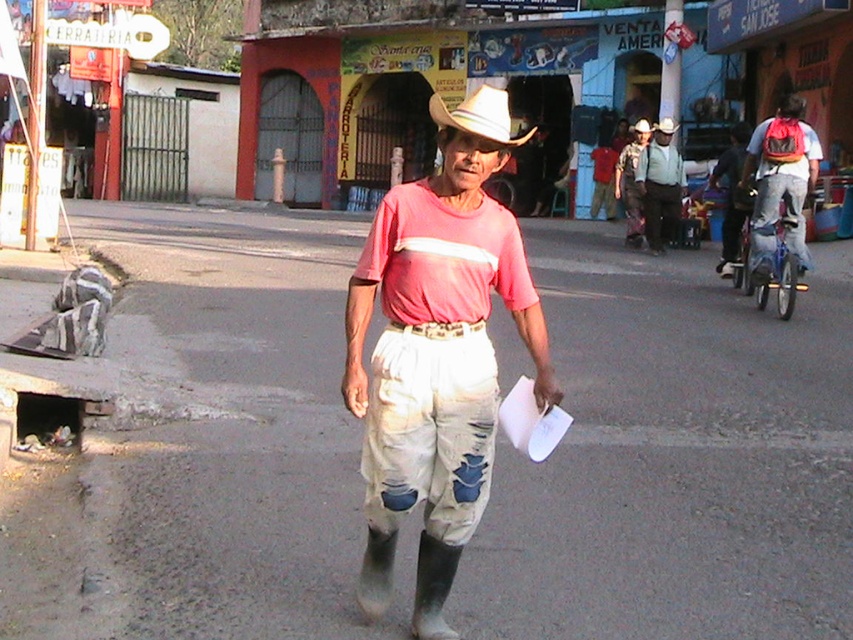
How distant is red backpack at right from white felt cowboy hat at center?

17.69 feet

Is red backpack at right closer to camera compared to white felt cowboy hat at center?

No, red backpack at right is further to the viewer.

Identify the location of red backpack at right. The height and width of the screenshot is (640, 853). (780, 180).

Consider the image. Does white felt cowboy hat at center appear on the right side of dark blue jeans at right?

In fact, white felt cowboy hat at center is to the left of dark blue jeans at right.

Locate an element on the screen. white felt cowboy hat at center is located at coordinates (479, 115).

Where is `white felt cowboy hat at center`? This screenshot has width=853, height=640. white felt cowboy hat at center is located at coordinates (479, 115).

Locate an element on the screen. This screenshot has height=640, width=853. white felt cowboy hat at center is located at coordinates (479, 115).

Between matte pink shirt at center and light blue denim shirt at center, which one appears on the left side from the viewer's perspective?

From the viewer's perspective, matte pink shirt at center appears more on the left side.

In the scene shown: Can you confirm if matte pink shirt at center is positioned above light blue denim shirt at center?

Incorrect, matte pink shirt at center is not positioned above light blue denim shirt at center.

In order to click on matte pink shirt at center in this screenshot , I will do `click(437, 353)`.